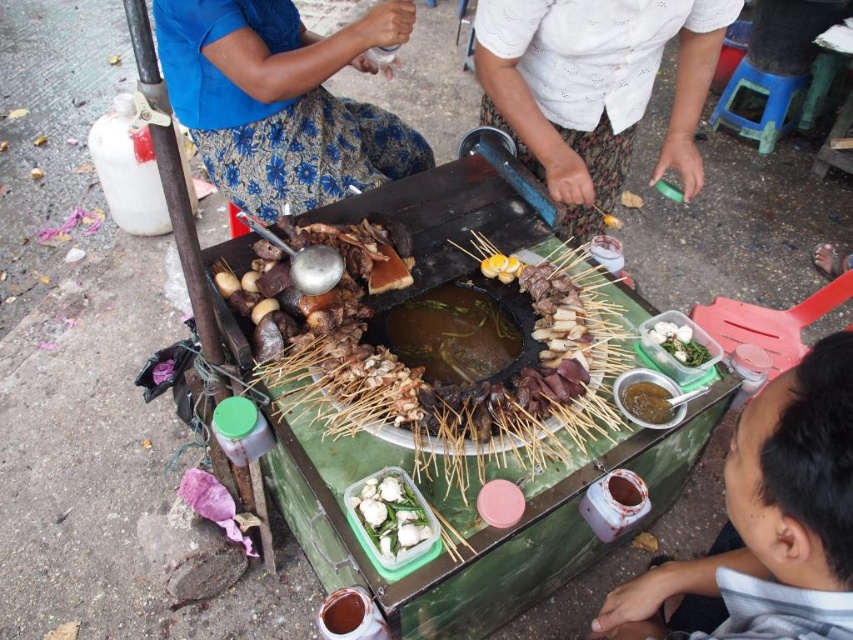
You are a customer at the food stall and want to grab the shiny brown sauce at center to dip your skewers. However, there is a white glossy shell at center in the way. Can you reach the sauce without moving the shell?

The white glossy shell at center is located below the shiny brown sauce at center, so you can reach the sauce by lifting it up from above the shell.

You are a customer at the food stall and want to choose between the gray cotton shirt at lower right and the blue floral skirt at upper left. Which item is smaller in size?

The gray cotton shirt at lower right has a smaller size compared to the blue floral skirt at upper left.

You are standing at the center of the street food stall and want to find the blue floral skirt at upper left. In which direction should you look to locate it?

The blue floral skirt at upper left is located at point (x=281, y=100), which is to the upper left direction from your current position at the center of the street food stall.